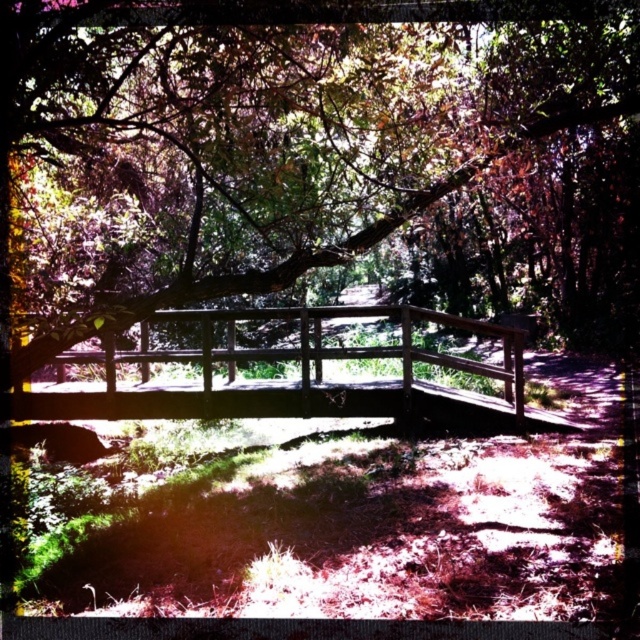
You are standing at the point marked as point [307,147] on the wooden bridge. Looking around, you notice a green leafy tree at center. Which direction should you face to see the green leafy tree at center?

Facing the center direction from point [307,147] on the wooden bridge will allow you to see the green leafy tree at center.